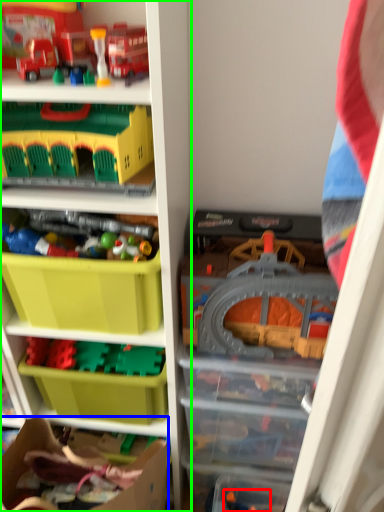
Question: Which object is the closest to the toy (highlighted by a red box)? Choose among these: cardboard box (highlighted by a blue box) or shelf (highlighted by a green box).

Choices:
 (A) cardboard box
 (B) shelf

Answer: (A)